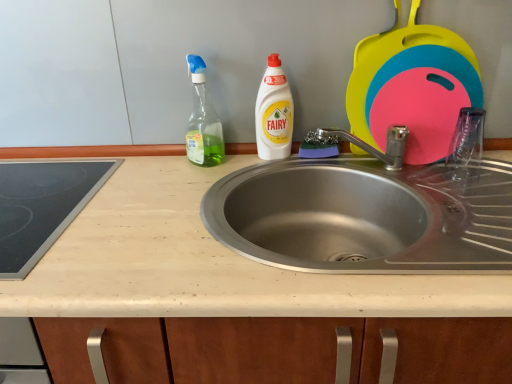
Locate an element on the screen. vacant space that is to the left of green glass spray bottle at upper left, which is the 2th cleaning product in right-to-left order is located at coordinates (139, 169).